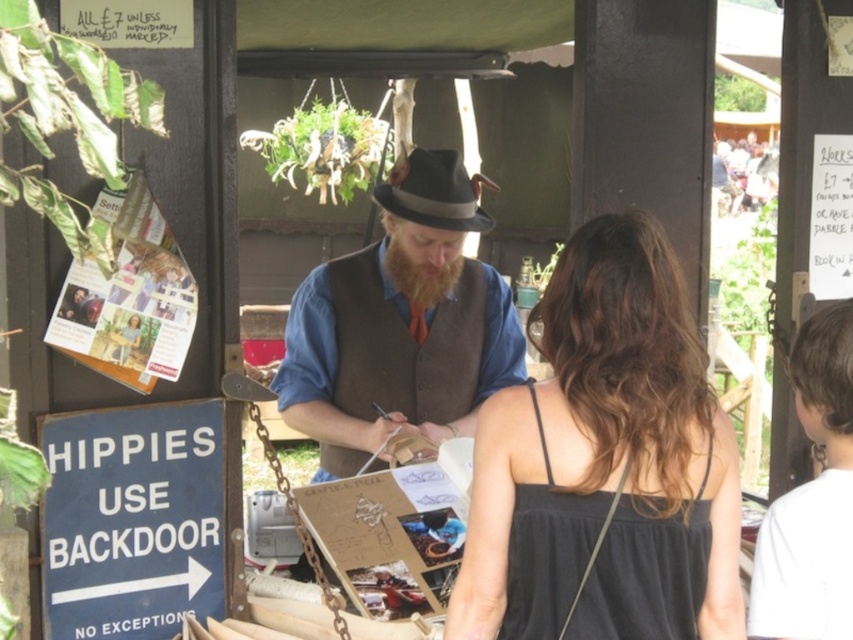
Can you confirm if black fabric dress at center is shorter than brown woolen vest at center?

Indeed, black fabric dress at center has a lesser height compared to brown woolen vest at center.

Identify the location of black fabric dress at center. The image size is (853, 640). (605, 464).

Is brown woolen vest at center below black satin dress at center?

Incorrect, brown woolen vest at center is not positioned below black satin dress at center.

Is brown woolen vest at center bigger than black satin dress at center?

Yes, brown woolen vest at center is bigger than black satin dress at center.

Which is behind, point (404, 348) or point (526, 496)?

Positioned behind is point (404, 348).

The width and height of the screenshot is (853, 640). What are the coordinates of `brown woolen vest at center` in the screenshot? It's located at (399, 323).

Does point (456, 205) lie behind point (428, 280)?

No, (456, 205) is closer to viewer.

Between point (402, 163) and point (444, 292), which one is positioned behind?

The point (444, 292) is behind.

The width and height of the screenshot is (853, 640). Identify the location of gray felt fedora at center. (434, 192).